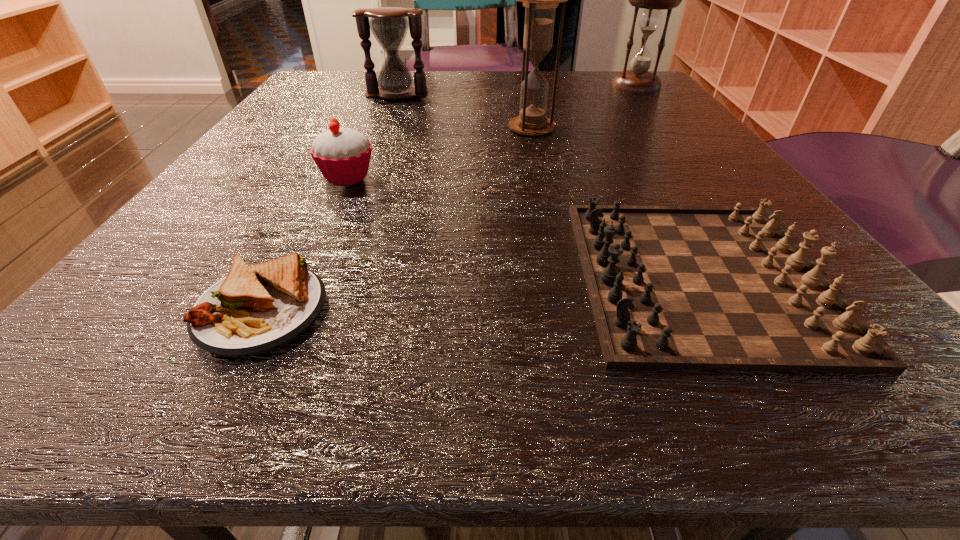
This screenshot has width=960, height=540. Find the location of `chessboard that is at the right edge`. chessboard that is at the right edge is located at coordinates (671, 287).

In order to click on object that is positioned at the far left corner in this screenshot , I will do `click(389, 25)`.

Identify the location of object that is at the near left corner. (255, 309).

Identify the location of object situated at the far right corner. (637, 80).

In order to click on object that is at the near right corner in this screenshot , I will do `click(671, 287)`.

In order to click on blank area at the far edge in this screenshot , I will do `click(398, 106)`.

Locate an element on the screen. free location at the near edge is located at coordinates (501, 350).

Image resolution: width=960 pixels, height=540 pixels. In the image, there is a desktop. Find the location of `vacant area at the left edge`. vacant area at the left edge is located at coordinates (209, 215).

Where is `vacant region at the right edge of the desktop`? This screenshot has height=540, width=960. vacant region at the right edge of the desktop is located at coordinates (690, 157).

You are a GUI agent. You are given a task and a screenshot of the screen. Output one action in this format:
    pyautogui.click(x=<x>, y=<y>)
    Task: Click on the vacant space at the near left corner of the desktop
    The image size is (960, 540).
    Given the screenshot: What is the action you would take?
    click(x=54, y=375)